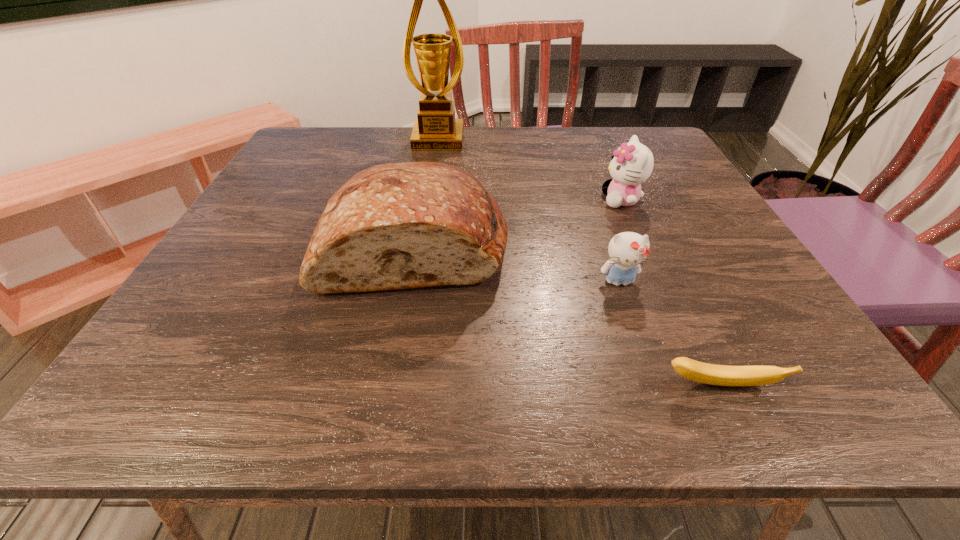
The image size is (960, 540). Find the location of `vacant area situated at the sliced front of the fourth shortest object`. vacant area situated at the sliced front of the fourth shortest object is located at coordinates (397, 340).

Locate an element on the screen. The image size is (960, 540). free space located 0.250m on the front-facing side of the third shortest object is located at coordinates (488, 200).

You are a GUI agent. You are given a task and a screenshot of the screen. Output one action in this format:
    pyautogui.click(x=<x>, y=<y>)
    Task: Click on the vacant space located on the front-facing side of the third shortest object
    The image size is (960, 540).
    Given the screenshot: What is the action you would take?
    pyautogui.click(x=443, y=200)

This screenshot has height=540, width=960. I want to click on vacant space located 0.270m on the front-facing side of the third shortest object, so click(x=479, y=200).

The image size is (960, 540). Find the location of `free space located 0.200m on the front-facing side of the nearer kitten`. free space located 0.200m on the front-facing side of the nearer kitten is located at coordinates (658, 395).

The width and height of the screenshot is (960, 540). Identify the location of object that is at the far edge. (436, 129).

The width and height of the screenshot is (960, 540). I want to click on object that is positioned at the near edge, so click(722, 375).

In order to click on kitten situated at the right edge in this screenshot , I will do `click(632, 163)`.

Where is `banana present at the right edge`? This screenshot has width=960, height=540. banana present at the right edge is located at coordinates (722, 375).

At what (x,y) coordinates should I click in order to perform the action: click on object present at the near right corner. Please return your answer as a coordinate pair (x, y). Image resolution: width=960 pixels, height=540 pixels. Looking at the image, I should click on (722, 375).